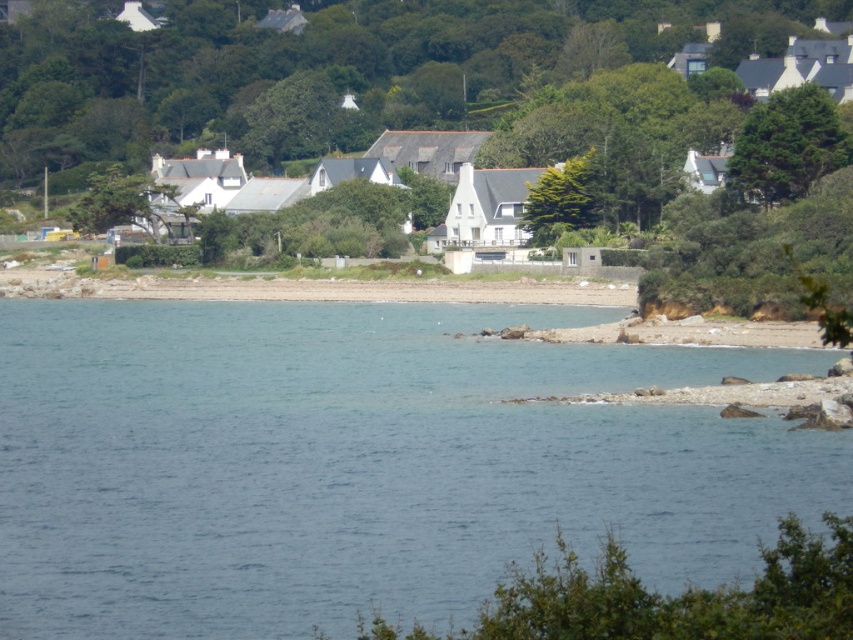
Question: Is the position of green textured tree at upper right less distant than that of green leafy tree at center?

Choices:
 (A) yes
 (B) no

Answer: (A)

Question: Estimate the real-world distances between objects in this image. Which object is closer to the green leafy tree at center?

Choices:
 (A) blue water at center
 (B) green textured tree at upper right

Answer: (B)

Question: Which of the following is the closest to the observer?

Choices:
 (A) (776, 173)
 (B) (592, 218)

Answer: (A)

Question: Is blue water at center closer to the viewer compared to green textured tree at upper right?

Choices:
 (A) no
 (B) yes

Answer: (B)

Question: Does green textured tree at upper right have a lesser width compared to green leafy tree at center?

Choices:
 (A) yes
 (B) no

Answer: (B)

Question: Which point is closer to the camera taking this photo?

Choices:
 (A) (566, 227)
 (B) (752, 154)
 (C) (213, 490)

Answer: (C)